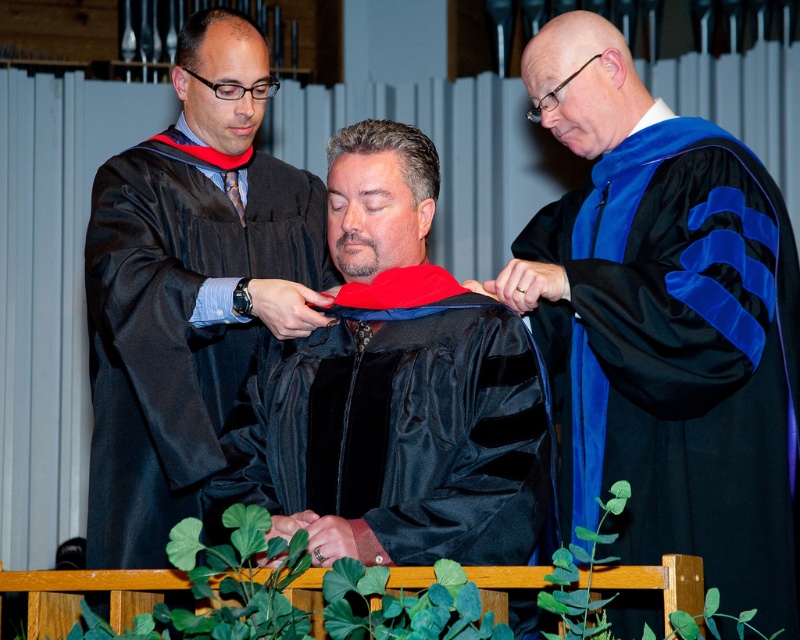
Question: Which point is farther to the camera?

Choices:
 (A) black satin graduation gown at center
 (B) matte black graduation gown at left

Answer: (B)

Question: Is black satin graduation gown at center thinner than matte black graduation gown at left?

Choices:
 (A) no
 (B) yes

Answer: (A)

Question: Which of the following is the farthest from the observer?

Choices:
 (A) matte black graduation gown at left
 (B) black satin graduation gown at center

Answer: (A)

Question: Is black satin graduation gown at center positioned in front of matte black graduation gown at left?

Choices:
 (A) yes
 (B) no

Answer: (A)

Question: Which point is farther from the camera taking this photo?

Choices:
 (A) (214, 118)
 (B) (578, 221)

Answer: (A)

Question: Is the position of black satin graduation gown at center more distant than that of matte black graduation gown at left?

Choices:
 (A) no
 (B) yes

Answer: (A)